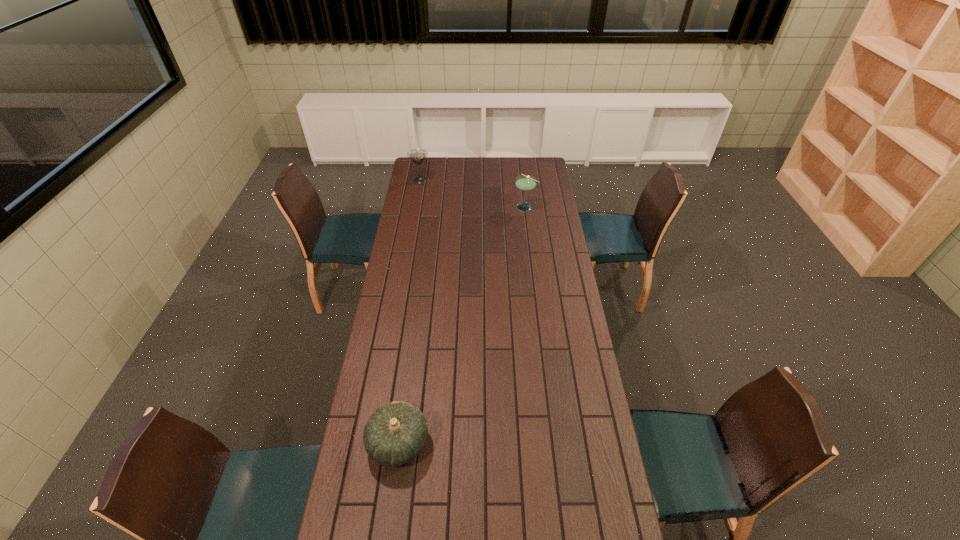
You are a GUI agent. You are given a task and a screenshot of the screen. Output one action in this format:
    pyautogui.click(x=<x>, y=<y>)
    Task: Click on the left martini
    
    Given the screenshot: What is the action you would take?
    pyautogui.click(x=418, y=155)

Find the location of a particular element. The image size is (960, 540). the farther martini is located at coordinates pos(418,155).

The image size is (960, 540). In order to click on the right martini in this screenshot , I will do `click(524, 183)`.

Find the location of a particular element. Image resolution: width=960 pixels, height=540 pixels. the rightmost object is located at coordinates (524, 183).

Find the location of a particular element. the nearest object is located at coordinates (395, 434).

Where is `free spot located 0.060m on the right of the left martini`? This screenshot has width=960, height=540. free spot located 0.060m on the right of the left martini is located at coordinates (441, 180).

What are the coordinates of `vacant space located 0.340m on the front of the second farthest object` in the screenshot? It's located at (531, 256).

This screenshot has height=540, width=960. Identify the location of vacant space located on the right of the gourd. (447, 442).

Find the location of a particular element. The image size is (960, 540). object located at the far edge is located at coordinates (418, 155).

Find the location of a particular element. martini situated at the left edge is located at coordinates (418, 155).